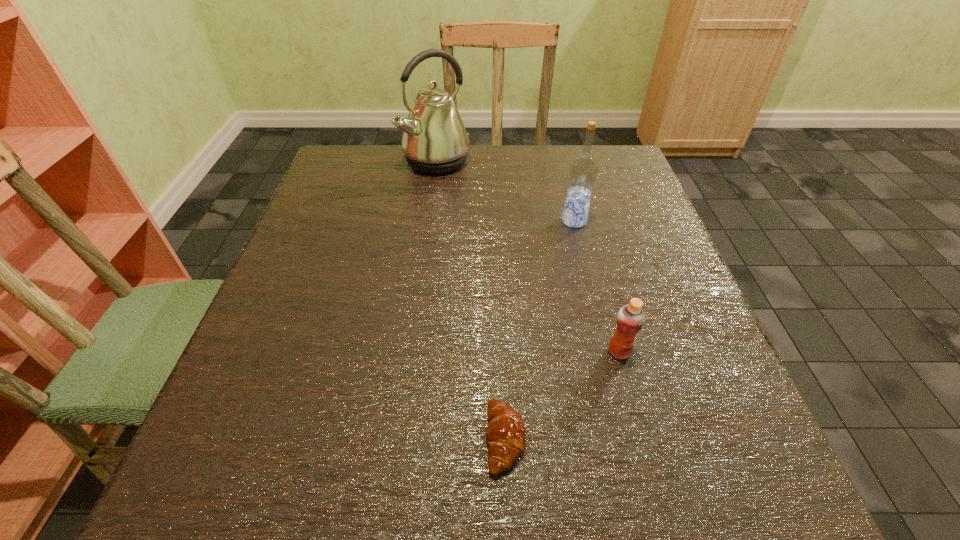
In order to click on free space located on the back of the orange juice in this screenshot , I will do `click(597, 270)`.

At what (x,y) coordinates should I click in order to perform the action: click on vacant space positioned on the back of the third object from right to left. Please return your answer as a coordinate pair (x, y). Looking at the image, I should click on (497, 256).

You are a GUI agent. You are given a task and a screenshot of the screen. Output one action in this format:
    pyautogui.click(x=<x>, y=<y>)
    Task: Click on the object that is at the far edge
    This screenshot has width=960, height=540.
    Given the screenshot: What is the action you would take?
    pyautogui.click(x=435, y=141)

Locate an element on the screen. object present at the near edge is located at coordinates (505, 433).

At what (x,y) coordinates should I click in order to perform the action: click on vodka present at the right edge. Please return your answer as a coordinate pair (x, y). Looking at the image, I should click on (583, 169).

In order to click on orange juice at the right edge in this screenshot , I will do `click(630, 319)`.

Locate an element on the screen. vacant space at the far edge of the desktop is located at coordinates (503, 152).

In the image, there is a desktop. At what (x,y) coordinates should I click in order to perform the action: click on free space at the right edge. Please return your answer as a coordinate pair (x, y). This screenshot has width=960, height=540. Looking at the image, I should click on (676, 436).

The width and height of the screenshot is (960, 540). In the image, there is a desktop. Identify the location of vacant space at the far left corner. (375, 168).

Identify the location of free space at the near left corner of the desktop. (199, 487).